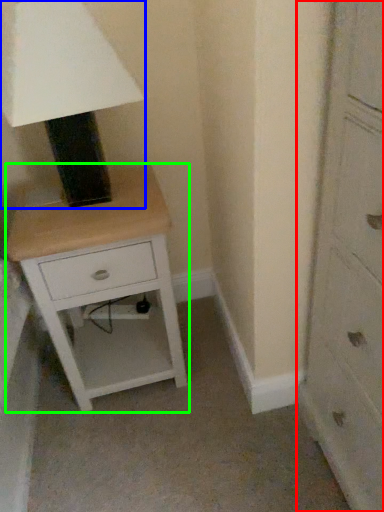
Question: Which is nearer to the chest of drawers (highlighted by a red box)? table lamp (highlighted by a blue box) or nightstand (highlighted by a green box).

Choices:
 (A) table lamp
 (B) nightstand

Answer: (B)